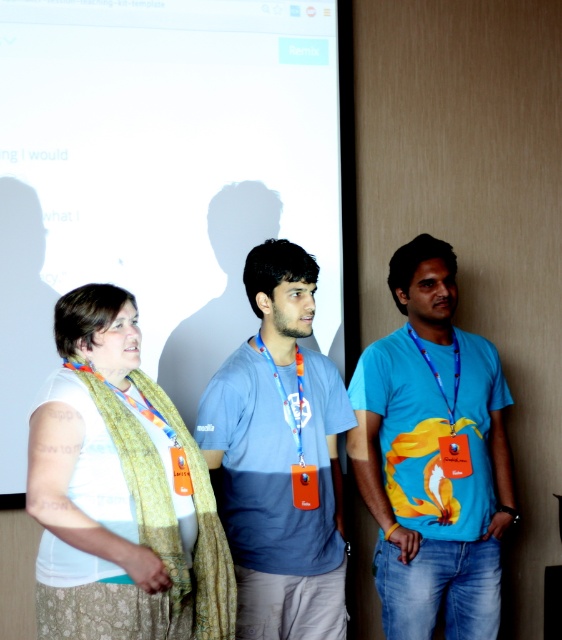
Can you confirm if blue printed t-shirt at center is bigger than white fabric scarf at center?

Correct, blue printed t-shirt at center is larger in size than white fabric scarf at center.

Can you confirm if blue printed t-shirt at center is positioned to the right of white fabric scarf at center?

Yes, blue printed t-shirt at center is to the right of white fabric scarf at center.

Is point (409, 536) more distant than point (92, 296)?

Yes, point (409, 536) is farther from viewer.

This screenshot has width=562, height=640. I want to click on blue printed t-shirt at center, so click(x=432, y=456).

Consider the image. Measure the distance from white matte projection screen at upper left to blue cotton t-shirt at center.

white matte projection screen at upper left is 28.49 inches from blue cotton t-shirt at center.

Which is behind, point (174, 161) or point (232, 364)?

The point (174, 161) is more distant.

Who is more forward, (158, 316) or (310, 518)?

Point (310, 518) is in front.

Locate an element on the screen. white matte projection screen at upper left is located at coordinates (162, 173).

Measure the distance between blue printed t-shirt at center and camera.

blue printed t-shirt at center and camera are 7.34 feet apart.

Which is behind, point (451, 259) or point (293, 349)?

The point (451, 259) is behind.

You are a GUI agent. You are given a task and a screenshot of the screen. Output one action in this format:
    pyautogui.click(x=<x>, y=<y>)
    Task: Click on the blue printed t-shirt at center
    This screenshot has width=562, height=640.
    Given the screenshot: What is the action you would take?
    pyautogui.click(x=432, y=456)